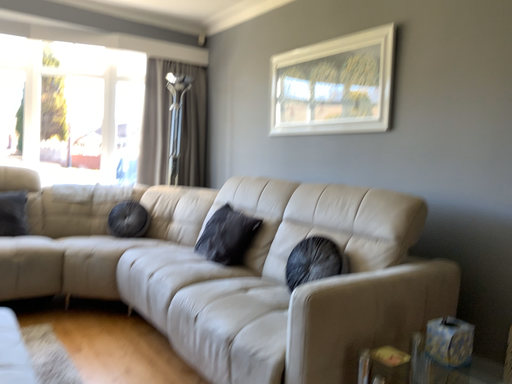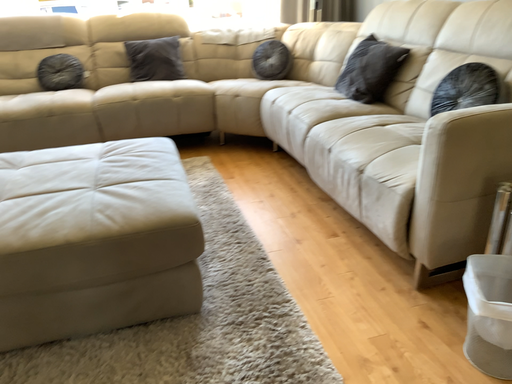
Question: Which way did the camera rotate in the video?

Choices:
 (A) rotated downward
 (B) rotated upward

Answer: (A)